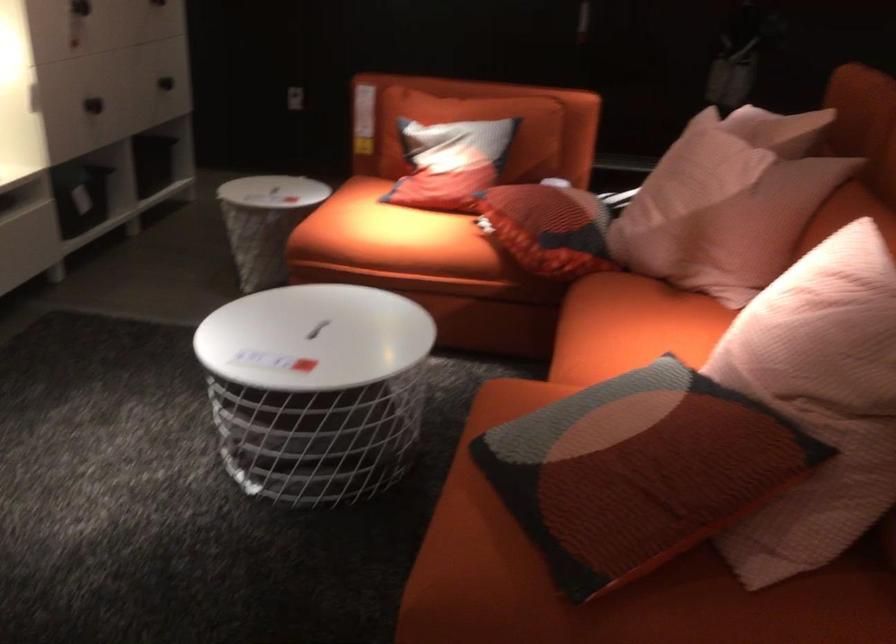
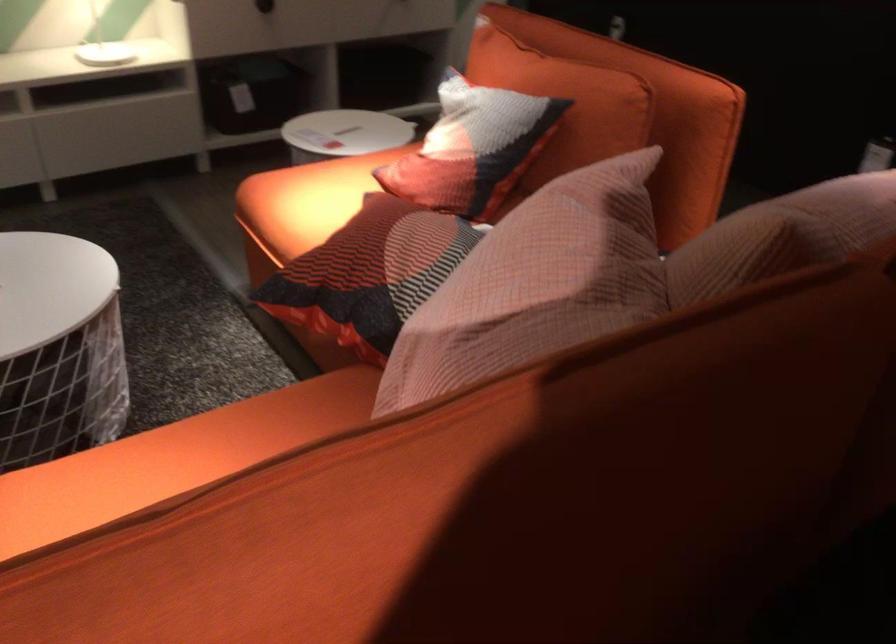
In the second image, find the point that corresponds to (x=438, y=326) in the first image.

(322, 348)